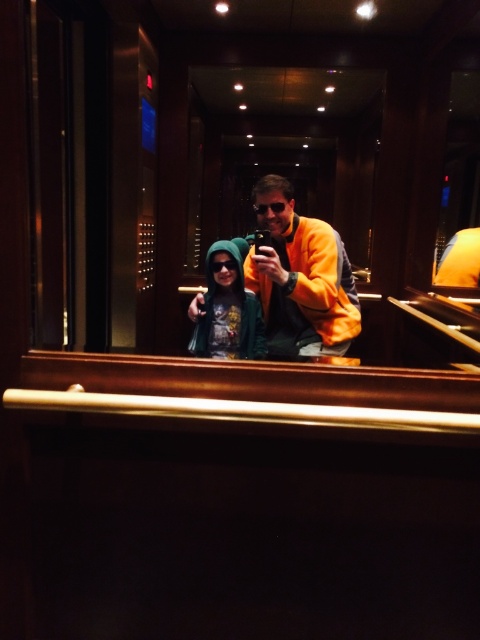
You are standing inside an elevator with two people. One is wearing a dark hoodie with a green hood holding a smartphone, and the other is wearing a yellow fleece jacket at center. Based on their positions, which person is closer to the metallic handrail running along the foreground?

The yellow fleece jacket at center is closer to the metallic handrail because it is located at point (300,276), which is closer to the foreground where the handrail is positioned.

You are a photographer trying to capture a group photo of the yellow fleece jacket at center and the green hoodie at center in the elevator. Since the elevator is small, you need to position them so that both are fully visible. Given their heights, which person should stand closer to the camera to ensure both are fully captured in the frame?

The yellow fleece jacket at center is much taller than the green hoodie at center, so to ensure both are fully visible in the frame, the taller yellow fleece jacket at center should stand closer to the camera while the shorter green hoodie at center should be positioned slightly behind. This way, the height difference will be minimized in the photo.